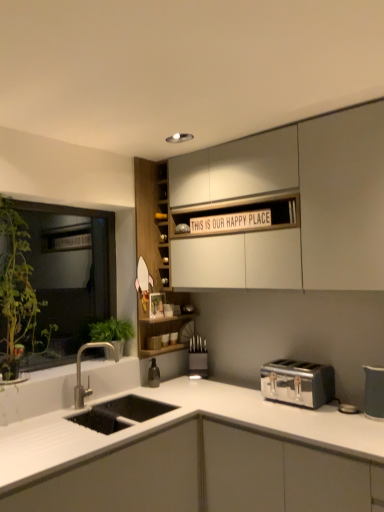
Question: Is satin nickel faucet at lower left directly adjacent to wooden cabinet at center, which is the 2th cabinetry from bottom to top?

Choices:
 (A) yes
 (B) no

Answer: (B)

Question: Is satin nickel faucet at lower left positioned with its back to wooden cabinet at center, the second cabinetry viewed from the top?

Choices:
 (A) no
 (B) yes

Answer: (A)

Question: Is satin nickel faucet at lower left to the right of wooden cabinet at center, which is the 2th cabinetry from bottom to top, from the viewer's perspective?

Choices:
 (A) yes
 (B) no

Answer: (B)

Question: From a real-world perspective, is satin nickel faucet at lower left beneath wooden cabinet at center, the second cabinetry viewed from the top?

Choices:
 (A) no
 (B) yes

Answer: (B)

Question: Considering the relative sizes of satin nickel faucet at lower left and wooden cabinet at center, which is the 2th cabinetry from bottom to top, in the image provided, is satin nickel faucet at lower left smaller than wooden cabinet at center, which is the 2th cabinetry from bottom to top,?

Choices:
 (A) no
 (B) yes

Answer: (B)

Question: Considering the positions of point (16, 253) and point (283, 440), is point (16, 253) closer or farther from the camera than point (283, 440)?

Choices:
 (A) farther
 (B) closer

Answer: (A)

Question: Is green leafy plant at left in front of or behind white matte countertop at lower left, which appears as the third cabinetry when viewed from the top, in the image?

Choices:
 (A) front
 (B) behind

Answer: (B)

Question: Is green leafy plant at left taller or shorter than white matte countertop at lower left, which is counted as the first cabinetry, starting from the bottom?

Choices:
 (A) tall
 (B) short

Answer: (A)

Question: Considering the positions of green leafy plant at left and white matte countertop at lower left, which is counted as the first cabinetry, starting from the bottom, in the image, is green leafy plant at left wider or thinner than white matte countertop at lower left, which is counted as the first cabinetry, starting from the bottom,?

Choices:
 (A) wide
 (B) thin

Answer: (B)

Question: From their relative heights in the image, would you say matte gray pitcher at right, which ranks as the first appliance in right-to-left order, is taller or shorter than white matte cabinet at upper center, which is counted as the 1th cabinetry, starting from the top?

Choices:
 (A) short
 (B) tall

Answer: (A)

Question: Is matte gray pitcher at right, placed as the second appliance when sorted from back to front, inside the boundaries of white matte cabinet at upper center, which is counted as the 1th cabinetry, starting from the top, or outside?

Choices:
 (A) inside
 (B) outside

Answer: (B)

Question: Considering the positions of matte gray pitcher at right, positioned as the 2th appliance in left-to-right order, and white matte cabinet at upper center, positioned as the third cabinetry in bottom-to-top order, in the image, is matte gray pitcher at right, positioned as the 2th appliance in left-to-right order, bigger or smaller than white matte cabinet at upper center, positioned as the third cabinetry in bottom-to-top order,?

Choices:
 (A) small
 (B) big

Answer: (A)

Question: Considering the relative positions of matte gray pitcher at right, the 1th appliance positioned from the front, and white matte cabinet at upper center, which is counted as the 1th cabinetry, starting from the top, in the image provided, is matte gray pitcher at right, the 1th appliance positioned from the front, to the left or to the right of white matte cabinet at upper center, which is counted as the 1th cabinetry, starting from the top,?

Choices:
 (A) right
 (B) left

Answer: (A)

Question: Looking at the image, does metallic knife block at center, which is the 1th appliance from left to right, seem bigger or smaller compared to green leafy plant at left?

Choices:
 (A) small
 (B) big

Answer: (A)

Question: Is metallic knife block at center, the second appliance when ordered from front to back, spatially inside green leafy plant at left, or outside of it?

Choices:
 (A) inside
 (B) outside

Answer: (B)